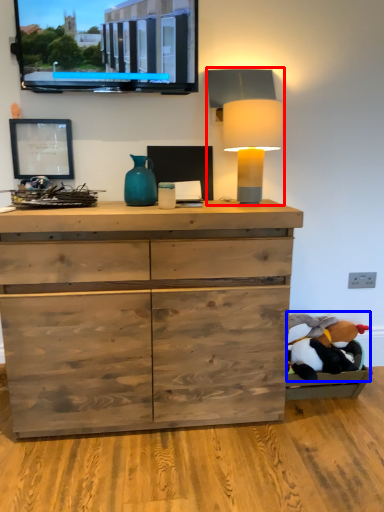
Question: Which point is closer to the camera, table lamp (highlighted by a red box) or animal (highlighted by a blue box)?

Choices:
 (A) table lamp
 (B) animal

Answer: (A)